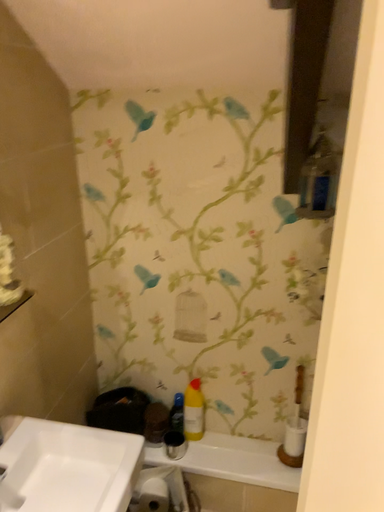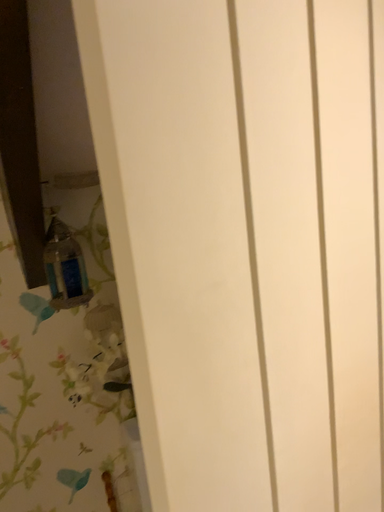
Question: How did the camera likely rotate when shooting the video?

Choices:
 (A) rotated downward
 (B) rotated upward

Answer: (B)